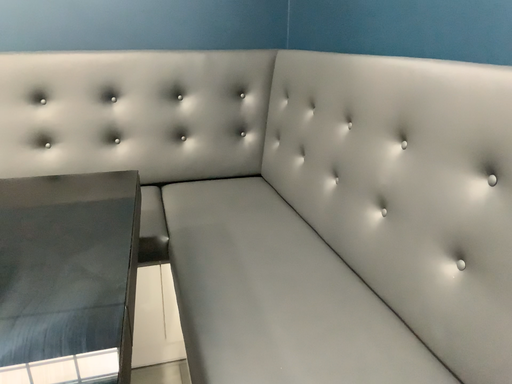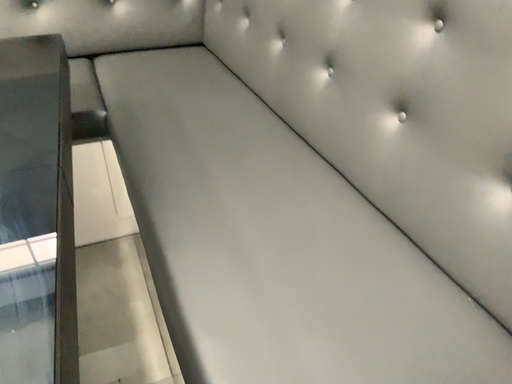
Question: Which way did the camera rotate in the video?

Choices:
 (A) rotated downward
 (B) rotated upward

Answer: (A)